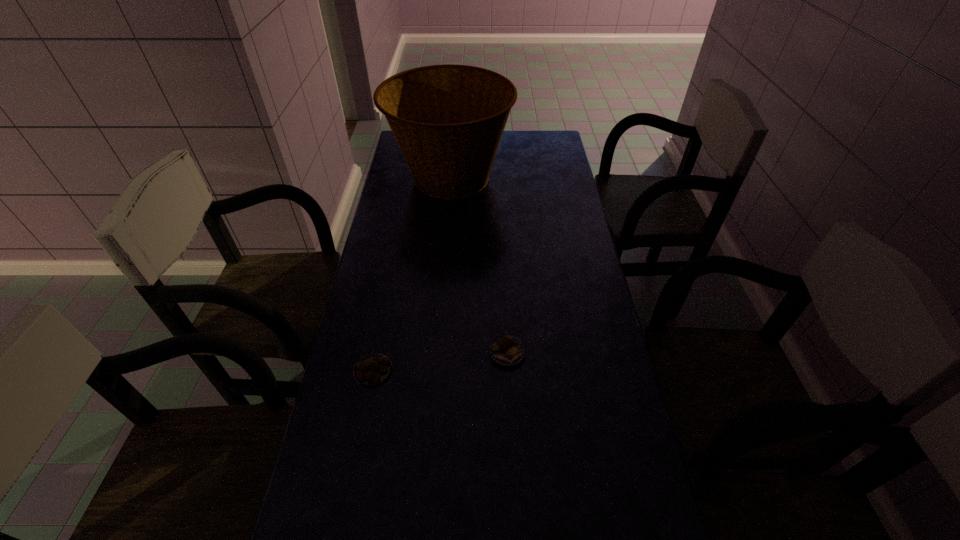
The height and width of the screenshot is (540, 960). I want to click on basket, so click(x=448, y=120).

Where is `the farthest object`? Image resolution: width=960 pixels, height=540 pixels. the farthest object is located at coordinates click(448, 120).

Where is `the taller pastry`? the taller pastry is located at coordinates (507, 351).

Locate an element on the screen. This screenshot has height=540, width=960. the right pastry is located at coordinates (507, 351).

I want to click on the shortest object, so click(x=373, y=369).

Locate an element on the screen. the shorter pastry is located at coordinates (373, 369).

Find the location of a particular element. This screenshot has height=540, width=960. vacant space located 0.190m on the right of the tallest object is located at coordinates (559, 178).

Where is `free space located 0.180m on the back of the taller pastry`? This screenshot has width=960, height=540. free space located 0.180m on the back of the taller pastry is located at coordinates (504, 291).

Locate an element on the screen. The width and height of the screenshot is (960, 540). free space located on the back of the shortest object is located at coordinates (386, 307).

Locate an element on the screen. The image size is (960, 540). object at the far edge is located at coordinates (448, 120).